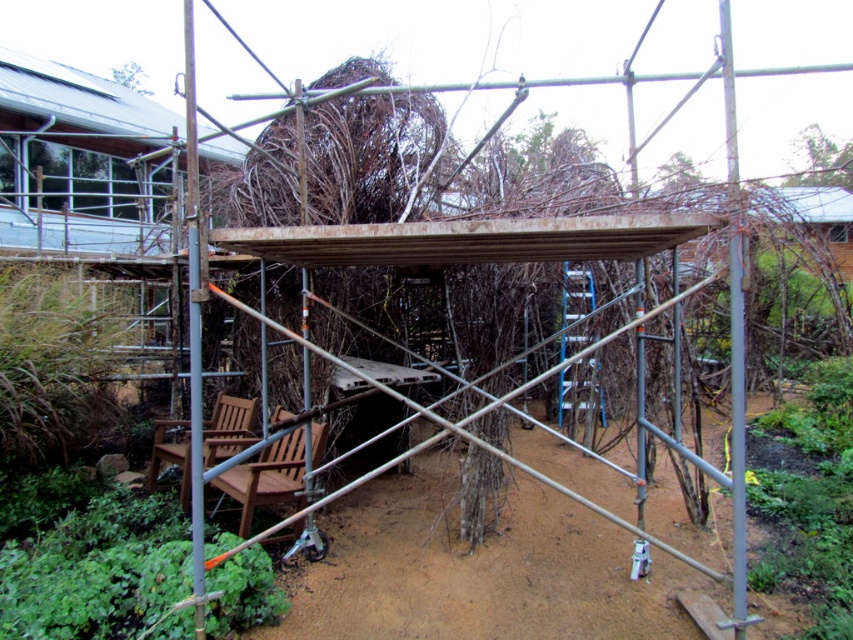
You are a construction worker who needs to choose a chair that can accommodate a visitor with a larger frame. Based on the scene, which chair would you recommend between the wooden chair at center and the wooden chair at lower left?

The wooden chair at lower left is larger in size compared to the wooden chair at center, so it can accommodate a visitor with a larger frame better.

You are standing at the point marked by the coordinate point (x=265, y=477). Looking towards the scaffolding structure, which object is closer to you? The wooden chair at center or the scaffolding structure?

The wooden chair at center is located at the coordinate point (x=265, y=477), so you are standing right at the wooden chair at center. Therefore, the scaffolding structure is farther away from you compared to the wooden chair at center since you are already at its position.

Consider the image. You are a construction worker needing to move from the wooden chair at lower left to the wooden chair at center. Which direction should you move to reach it?

You should move to the right to reach the wooden chair at center since it is positioned to the right of the wooden chair at lower left.